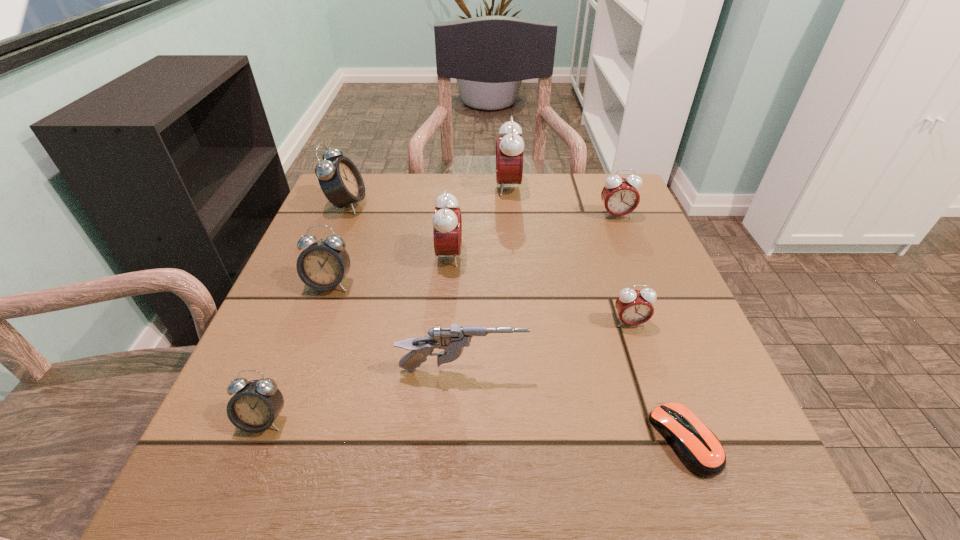
Identify the location of free space between the seventh farthest object and the biggest white alarm clock. This screenshot has width=960, height=540. (405, 287).

What are the coordinates of `free space between the third alarm clock from right to left and the second farthest pink alarm clock` in the screenshot? It's located at coord(562,201).

Identify the location of unoccupied area between the sixth farthest alarm clock and the farthest white alarm clock. (489, 264).

Where is `vacant area that lies between the gun and the second biggest pink alarm clock`? vacant area that lies between the gun and the second biggest pink alarm clock is located at coordinates (456, 313).

What are the coordinates of `vacant space in between the farthest pink alarm clock and the second smallest pink alarm clock` in the screenshot? It's located at (562, 201).

The width and height of the screenshot is (960, 540). Identify the location of vacant area that lies between the smallest pink alarm clock and the gun. (546, 346).

At what (x,y) coordinates should I click in order to perform the action: click on the third closest object to the farthest white alarm clock. Please return your answer as a coordinate pair (x, y). Looking at the image, I should click on (509, 149).

Identify which object is the eighth nearest to the third nearest object. Please provide its 2D coordinates. Your answer should be formatted as a tuple, i.e. [(x, y)], where the tuple contains the x and y coordinates of a point satisfying the conditions above.

[(509, 149)]

Point out which alarm clock is positioned as the fifth nearest to the second smallest pink alarm clock. Please provide its 2D coordinates. Your answer should be formatted as a tuple, i.e. [(x, y)], where the tuple contains the x and y coordinates of a point satisfying the conditions above.

[(322, 266)]

Identify which alarm clock is the third closest to the nearest alarm clock. Please provide its 2D coordinates. Your answer should be formatted as a tuple, i.e. [(x, y)], where the tuple contains the x and y coordinates of a point satisfying the conditions above.

[(340, 180)]